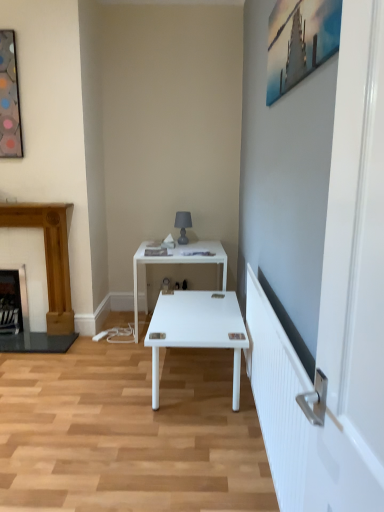
Find the location of `vacant space in front of wooden fireplace at left, which is the 1th fireplace in right-to-left order`. vacant space in front of wooden fireplace at left, which is the 1th fireplace in right-to-left order is located at coordinates (35, 357).